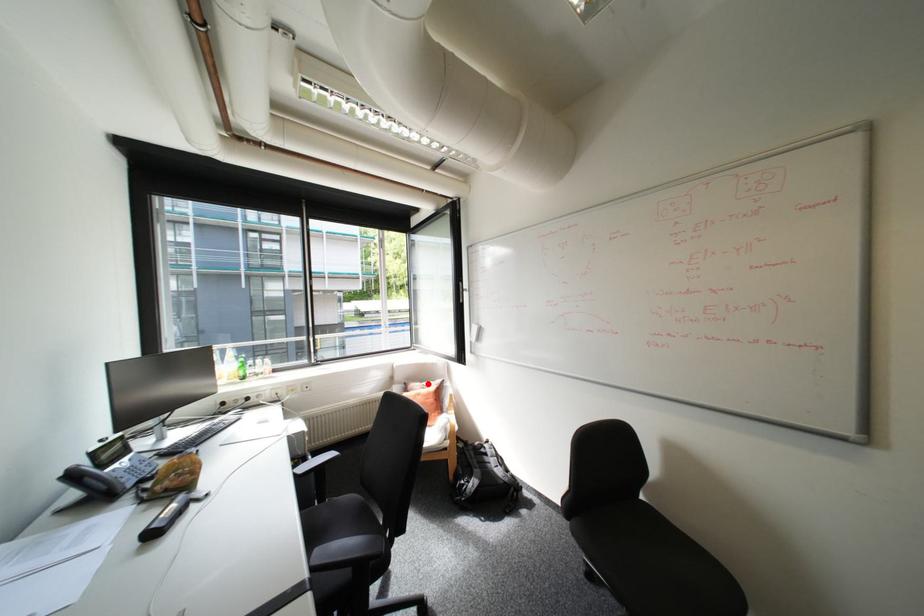
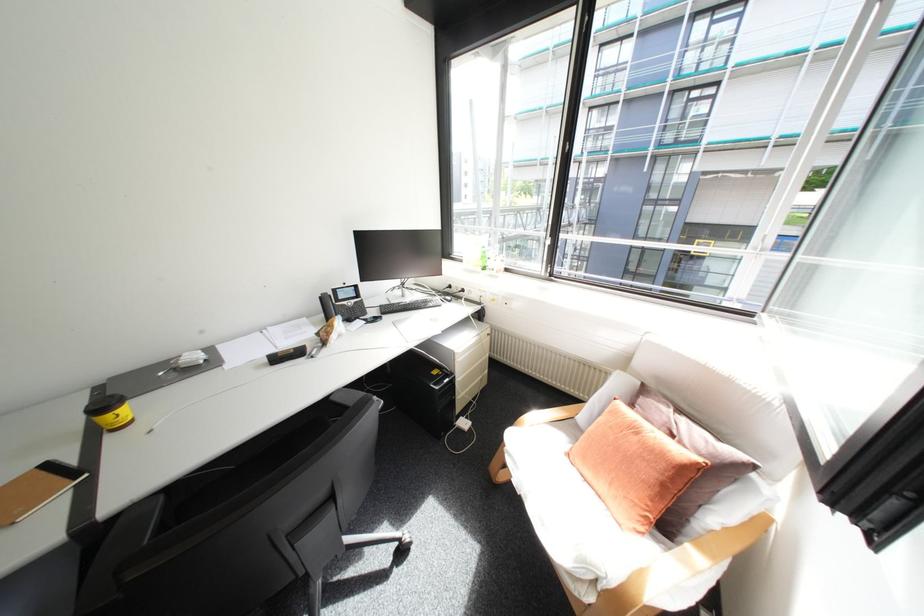
Question: I am providing you with two images of the same scene from different viewpoints. Given a red point in image1, look at the same physical point in image2. Is it:

Choices:
 (A) Closer to the viewpoint
 (B) Farther from the viewpoint

Answer: (A)